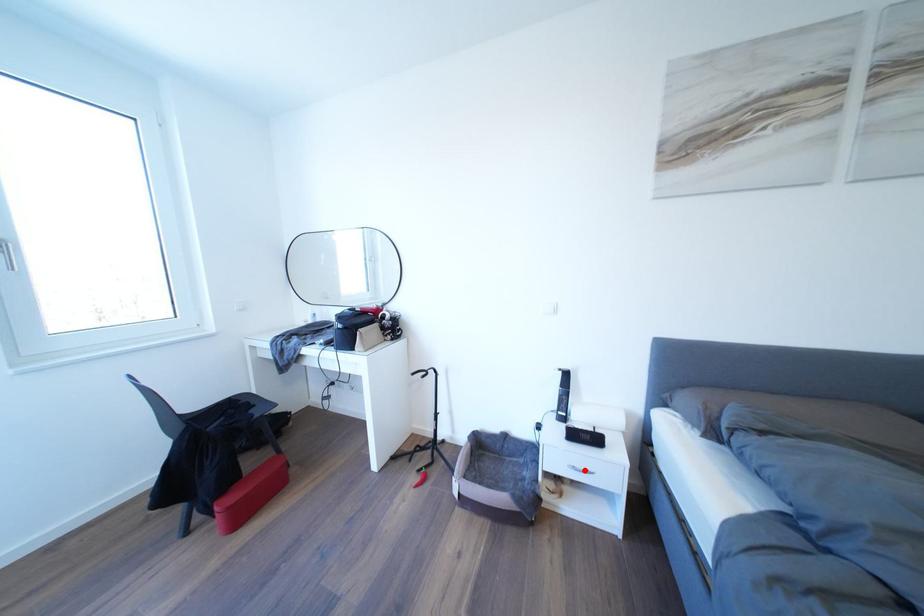
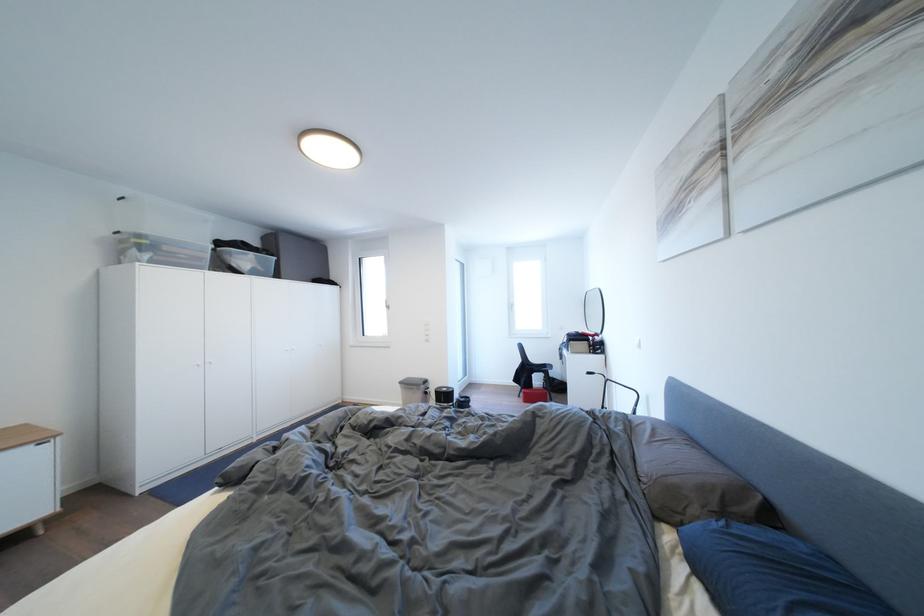
Question: I am providing you with two images of the same scene from different viewpoints. A red point is marked on the first image. Is the red point's position out of view in image 2?

Choices:
 (A) Yes
 (B) No

Answer: (A)